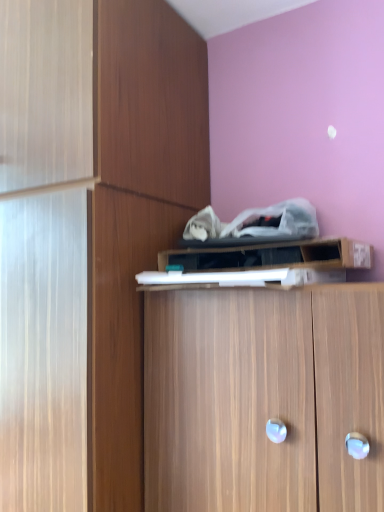
What do you see at coordinates (137, 213) in the screenshot? I see `wooden cabinet at center, arranged as the 2th cabinetry when ordered from the bottom` at bounding box center [137, 213].

Identify the location of wooden cabinet at center, arranged as the 2th cabinetry when ordered from the bottom. click(137, 213).

Is wooden cabinet at upper center, which is the third cabinetry in bottom-to-top order, oriented towards wooden cabinet at center, which is counted as the 2th cabinetry, starting from the top?

No, wooden cabinet at upper center, which is the third cabinetry in bottom-to-top order, does not turn towards wooden cabinet at center, which is counted as the 2th cabinetry, starting from the top.

From the image's perspective, which is below, wooden cabinet at upper center, placed as the first cabinetry when sorted from top to bottom, or wooden cabinet at center, arranged as the 2th cabinetry when ordered from the bottom?

wooden cabinet at center, arranged as the 2th cabinetry when ordered from the bottom, is shown below in the image.

From a real-world perspective, who is located higher, wooden cabinet at upper center, which is the third cabinetry in bottom-to-top order, or wooden cabinet at center, arranged as the 2th cabinetry when ordered from the bottom?

wooden cabinet at upper center, which is the third cabinetry in bottom-to-top order, is physically above.

Is the position of wooden cabinet at upper center, placed as the first cabinetry when sorted from top to bottom, more distant than that of wooden cabinet at center, arranged as the 2th cabinetry when ordered from the bottom?

Yes, the depth of wooden cabinet at upper center, placed as the first cabinetry when sorted from top to bottom, is greater than that of wooden cabinet at center, arranged as the 2th cabinetry when ordered from the bottom.

Considering the sizes of wooden cabinet at center, the 1th cabinetry ordered from the bottom, and wooden cabinet at upper center, which is the third cabinetry in bottom-to-top order, in the image, is wooden cabinet at center, the 1th cabinetry ordered from the bottom, taller or shorter than wooden cabinet at upper center, which is the third cabinetry in bottom-to-top order,?

wooden cabinet at center, the 1th cabinetry ordered from the bottom, is taller than wooden cabinet at upper center, which is the third cabinetry in bottom-to-top order.

Based on the photo, in the image, is wooden cabinet at center, the 1th cabinetry ordered from the bottom, positioned in front of or behind wooden cabinet at upper center, which is the third cabinetry in bottom-to-top order?

wooden cabinet at center, the 1th cabinetry ordered from the bottom, is positioned closer to the viewer than wooden cabinet at upper center, which is the third cabinetry in bottom-to-top order.

Consider the image. From a real-world perspective, is wooden cabinet at center, the 1th cabinetry ordered from the bottom, under wooden cabinet at upper center, which is the third cabinetry in bottom-to-top order?

Yes, from a real-world perspective, wooden cabinet at center, the 1th cabinetry ordered from the bottom, is beneath wooden cabinet at upper center, which is the third cabinetry in bottom-to-top order.

Which of these two, wooden cabinet at center, the 3th cabinetry in the top-to-bottom sequence, or wooden cabinet at upper center, placed as the first cabinetry when sorted from top to bottom, is wider?

wooden cabinet at center, the 3th cabinetry in the top-to-bottom sequence.

Considering the positions of point (235, 251) and point (221, 443), is point (235, 251) closer or farther from the camera than point (221, 443)?

Clearly, point (235, 251) is more distant from the camera than point (221, 443).

Does wooden cabinet at upper center, which is the third cabinetry in bottom-to-top order, have a larger size compared to wooden cabinet at center, the 3th cabinetry in the top-to-bottom sequence?

No, wooden cabinet at upper center, which is the third cabinetry in bottom-to-top order, is not bigger than wooden cabinet at center, the 3th cabinetry in the top-to-bottom sequence.

From a real-world perspective, is wooden cabinet at upper center, which is the third cabinetry in bottom-to-top order, positioned above or below wooden cabinet at center, the 1th cabinetry ordered from the bottom?

Clearly, from a real-world perspective, wooden cabinet at upper center, which is the third cabinetry in bottom-to-top order, is above wooden cabinet at center, the 1th cabinetry ordered from the bottom.

From the picture: From the image's perspective, which is below, wooden cabinet at upper center, placed as the first cabinetry when sorted from top to bottom, or wooden cabinet at center, the 1th cabinetry ordered from the bottom?

wooden cabinet at center, the 1th cabinetry ordered from the bottom.

Between point (126, 295) and point (241, 255), which one is positioned in front?

Positioned in front is point (126, 295).

Are wooden cabinet at center, which is counted as the 2th cabinetry, starting from the top, and wooden cabinet at upper center, which is the third cabinetry in bottom-to-top order, far apart?

No.

Is wooden cabinet at center, arranged as the 2th cabinetry when ordered from the bottom, looking in the opposite direction of wooden cabinet at upper center, which is the third cabinetry in bottom-to-top order?

No, wooden cabinet at center, arranged as the 2th cabinetry when ordered from the bottom, is not facing away from wooden cabinet at upper center, which is the third cabinetry in bottom-to-top order.

From a real-world perspective, is wooden cabinet at center, arranged as the 2th cabinetry when ordered from the bottom, on wooden cabinet at center, the 1th cabinetry ordered from the bottom?

Yes, from a real-world perspective, wooden cabinet at center, arranged as the 2th cabinetry when ordered from the bottom, is above wooden cabinet at center, the 1th cabinetry ordered from the bottom.

Can you confirm if wooden cabinet at center, which is counted as the 2th cabinetry, starting from the top, is wider than wooden cabinet at center, the 3th cabinetry in the top-to-bottom sequence?

Indeed, wooden cabinet at center, which is counted as the 2th cabinetry, starting from the top, has a greater width compared to wooden cabinet at center, the 3th cabinetry in the top-to-bottom sequence.

Locate an element on the screen. This screenshot has height=512, width=384. cabinetry lying in front of the wooden cabinet at center, which is counted as the 2th cabinetry, starting from the top is located at coordinates [x=263, y=398].

Is wooden cabinet at center, the 1th cabinetry ordered from the bottom, at the back of wooden cabinet at center, arranged as the 2th cabinetry when ordered from the bottom?

No, wooden cabinet at center, arranged as the 2th cabinetry when ordered from the bottom, is not facing away from wooden cabinet at center, the 1th cabinetry ordered from the bottom.

Consider the image. From a real-world perspective, is wooden cabinet at center, the 1th cabinetry ordered from the bottom, on top of wooden cabinet at center, arranged as the 2th cabinetry when ordered from the bottom?

No.

Which object is positioned more to the left, wooden cabinet at center, the 3th cabinetry in the top-to-bottom sequence, or wooden cabinet at center, arranged as the 2th cabinetry when ordered from the bottom?

From the viewer's perspective, wooden cabinet at center, arranged as the 2th cabinetry when ordered from the bottom, appears more on the left side.

Between wooden cabinet at center, the 3th cabinetry in the top-to-bottom sequence, and wooden cabinet at center, which is counted as the 2th cabinetry, starting from the top, which one has larger width?

Wider between the two is wooden cabinet at center, which is counted as the 2th cabinetry, starting from the top.

Which cabinetry is the 1st one when counting from the right side of the wooden cabinet at center, arranged as the 2th cabinetry when ordered from the bottom? Please provide its 2D coordinates.

[(273, 255)]

From the image's perspective, starting from the wooden cabinet at center, the 3th cabinetry in the top-to-bottom sequence, which cabinetry is the 2nd one above? Please provide its 2D coordinates.

[(273, 255)]

Looking at the image, which one is located closer to wooden cabinet at center, which is counted as the 2th cabinetry, starting from the top, wooden cabinet at center, the 3th cabinetry in the top-to-bottom sequence, or wooden cabinet at upper center, which is the third cabinetry in bottom-to-top order?

wooden cabinet at upper center, which is the third cabinetry in bottom-to-top order, is closer to wooden cabinet at center, which is counted as the 2th cabinetry, starting from the top.

From the image, which object appears to be nearer to wooden cabinet at center, the 3th cabinetry in the top-to-bottom sequence, wooden cabinet at upper center, which is the third cabinetry in bottom-to-top order, or wooden cabinet at center, which is counted as the 2th cabinetry, starting from the top?

The object closer to wooden cabinet at center, the 3th cabinetry in the top-to-bottom sequence, is wooden cabinet at upper center, which is the third cabinetry in bottom-to-top order.

Which object lies further to the anchor point wooden cabinet at center, the 1th cabinetry ordered from the bottom, wooden cabinet at center, arranged as the 2th cabinetry when ordered from the bottom, or wooden cabinet at upper center, placed as the first cabinetry when sorted from top to bottom?

wooden cabinet at center, arranged as the 2th cabinetry when ordered from the bottom, lies further to wooden cabinet at center, the 1th cabinetry ordered from the bottom, than the other object.

Estimate the real-world distances between objects in this image. Which object is closer to wooden cabinet at upper center, which is the third cabinetry in bottom-to-top order, wooden cabinet at center, the 1th cabinetry ordered from the bottom, or wooden cabinet at center, which is counted as the 2th cabinetry, starting from the top?

Among the two, wooden cabinet at center, the 1th cabinetry ordered from the bottom, is located nearer to wooden cabinet at upper center, which is the third cabinetry in bottom-to-top order.

From the image, which object appears to be farther from wooden cabinet at center, arranged as the 2th cabinetry when ordered from the bottom, wooden cabinet at upper center, placed as the first cabinetry when sorted from top to bottom, or wooden cabinet at center, the 3th cabinetry in the top-to-bottom sequence?

wooden cabinet at center, the 3th cabinetry in the top-to-bottom sequence.

When comparing their distances from wooden cabinet at upper center, placed as the first cabinetry when sorted from top to bottom, does wooden cabinet at center, arranged as the 2th cabinetry when ordered from the bottom, or wooden cabinet at center, the 3th cabinetry in the top-to-bottom sequence, seem further?

Based on the image, wooden cabinet at center, arranged as the 2th cabinetry when ordered from the bottom, appears to be further to wooden cabinet at upper center, placed as the first cabinetry when sorted from top to bottom.

This screenshot has width=384, height=512. I want to click on cabinetry located between wooden cabinet at center, which is counted as the 2th cabinetry, starting from the top, and wooden cabinet at center, the 3th cabinetry in the top-to-bottom sequence, in the left-right direction, so click(x=273, y=255).